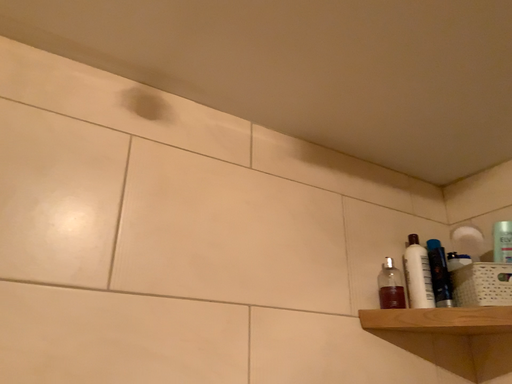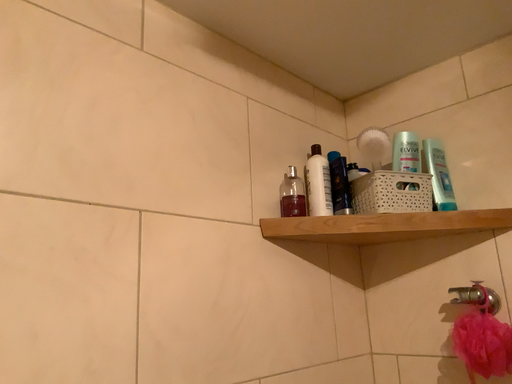
Question: Which way did the camera rotate in the video?

Choices:
 (A) rotated left
 (B) rotated right

Answer: (B)